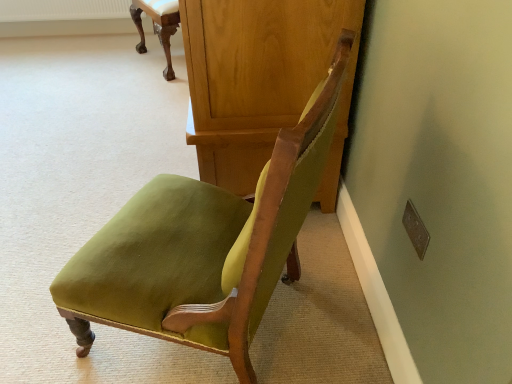
Find the location of a particular element. The image size is (512, 384). free spot in front of matte green fabric chair at upper center, the second chair from the bottom is located at coordinates (142, 88).